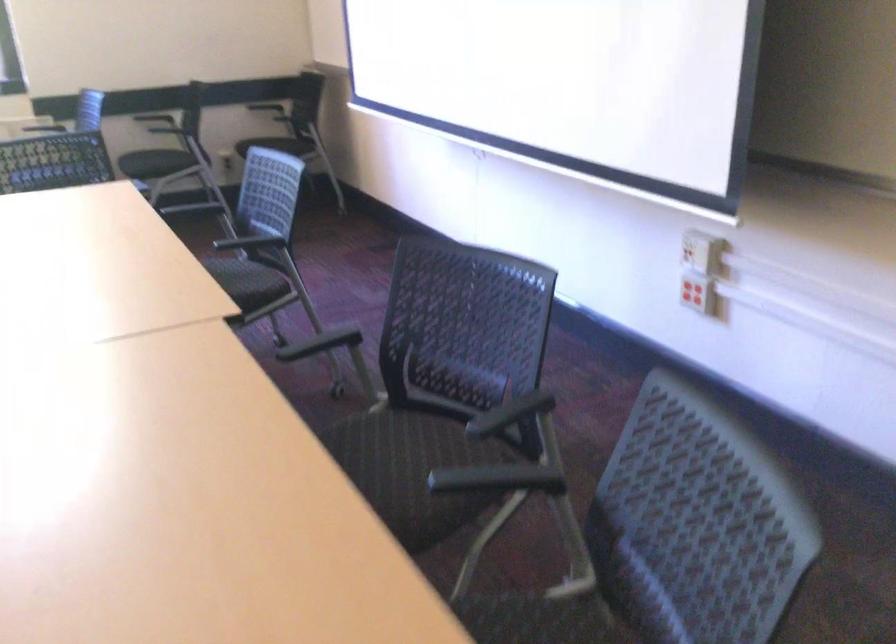
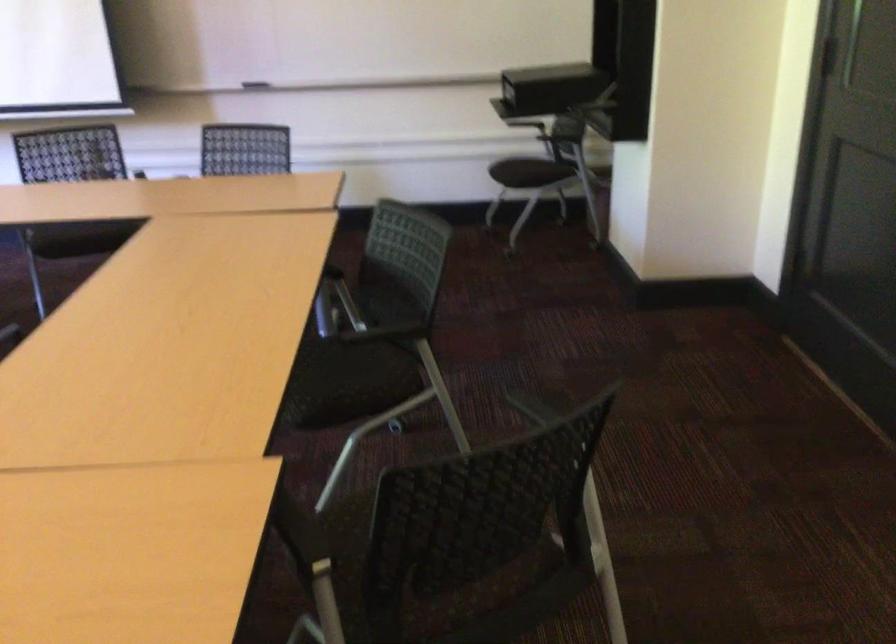
Question: I am providing you with two images of the same scene from different viewpoints. Please identify which objects are invisible in image2.

Choices:
 (A) black chair armrest
 (B) black chair sitting surface
 (C) black document camera
 (D) clear CD case

Answer: (B)